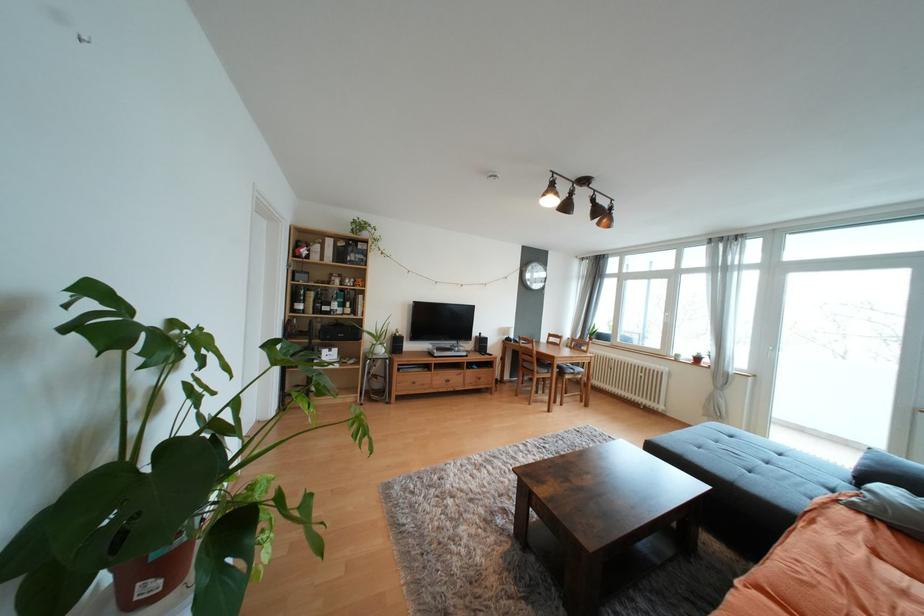
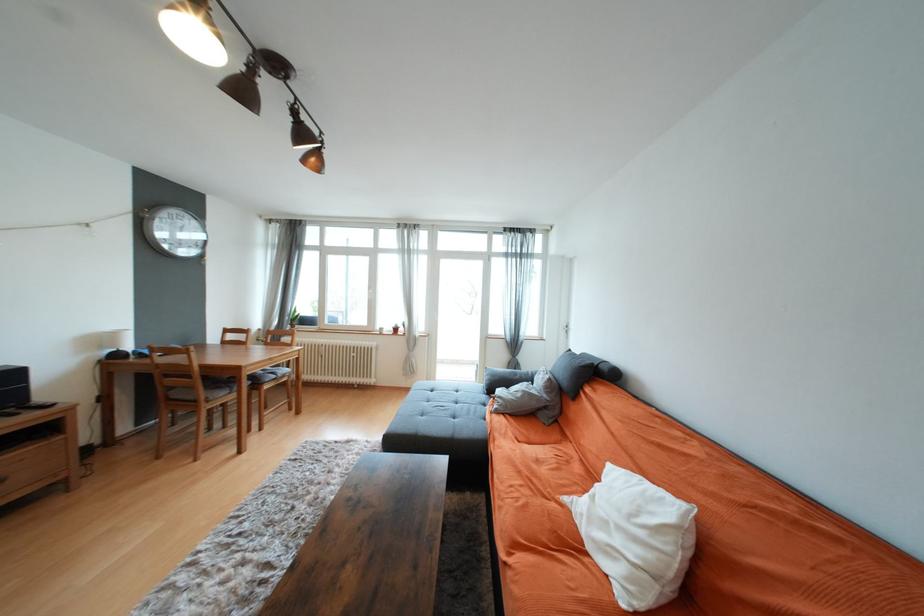
Find the pixel in the second image that matches point 611,222 in the first image.

(319, 161)